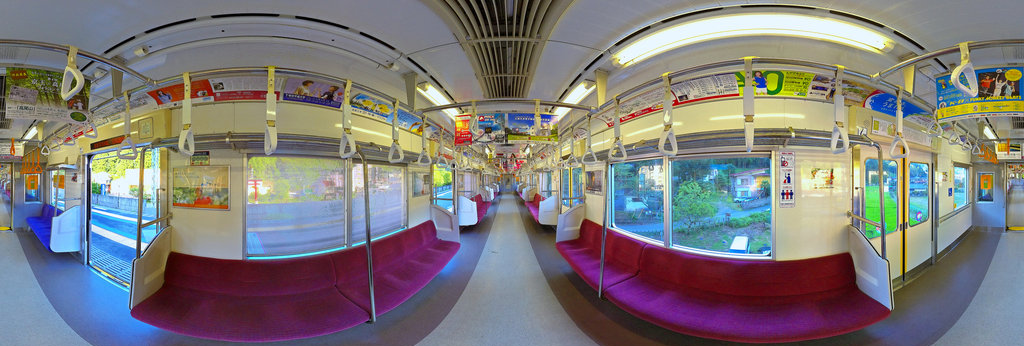
Locate an element on the screen. The width and height of the screenshot is (1024, 346). door is located at coordinates (915, 241).